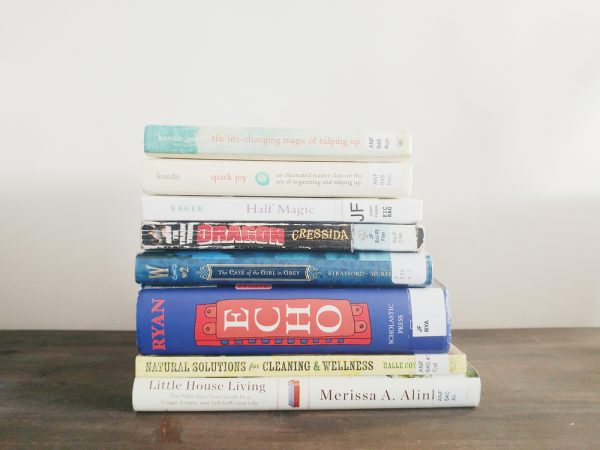
I want to click on book, so click(x=258, y=396), click(x=250, y=365), click(x=264, y=327), click(x=275, y=270), click(x=279, y=224), click(x=279, y=211), click(x=287, y=169), click(x=286, y=139).